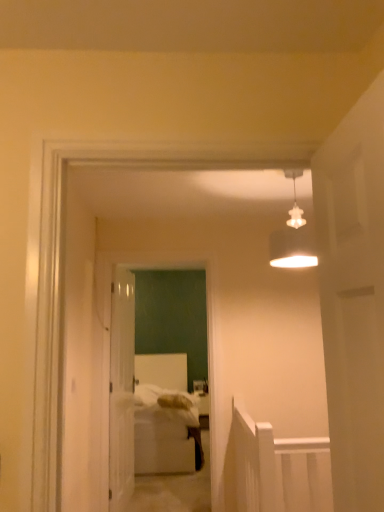
Find the location of `free space to the back side of white glossy door at center, which is the second door in front-to-back order`. free space to the back side of white glossy door at center, which is the second door in front-to-back order is located at coordinates (148, 488).